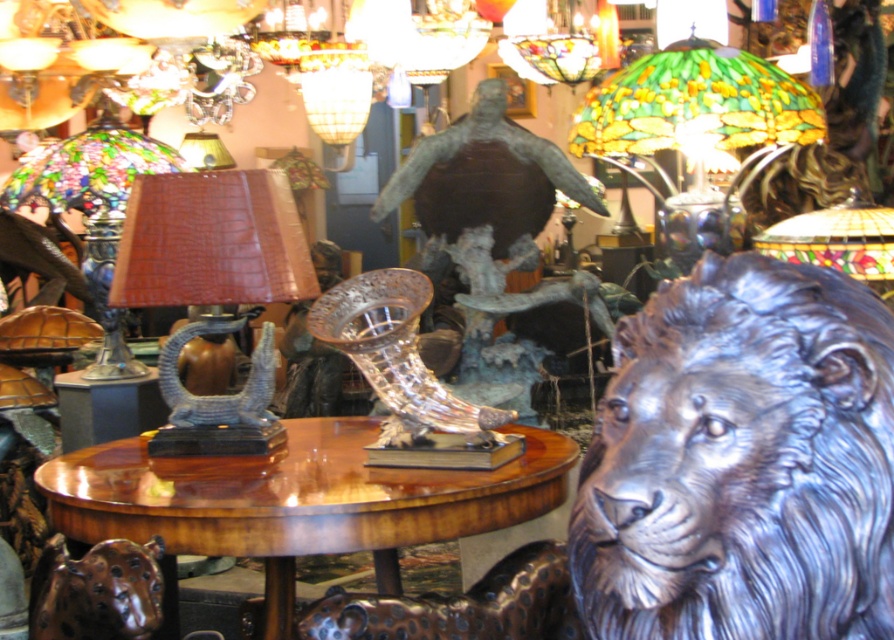
Question: Which point is farther to the camera?

Choices:
 (A) stained glass lampshade at upper right
 (B) brown leather lamp at center

Answer: (A)

Question: Does brown leather lamp at center appear on the right side of stained glass lampshade at upper right?

Choices:
 (A) no
 (B) yes

Answer: (A)

Question: Is shiny silver lion head at center positioned at the back of stained glass lampshade at upper right?

Choices:
 (A) yes
 (B) no

Answer: (B)

Question: Which point is closer to the camera?

Choices:
 (A) stained glass lampshade at upper right
 (B) brown leather lamp at center

Answer: (B)

Question: Which point is farther to the camera?

Choices:
 (A) shiny silver lion head at center
 (B) stained glass lampshade at upper right

Answer: (B)

Question: Is shiny wood table at center positioned in front of stained glass lampshade at upper right?

Choices:
 (A) yes
 (B) no

Answer: (A)